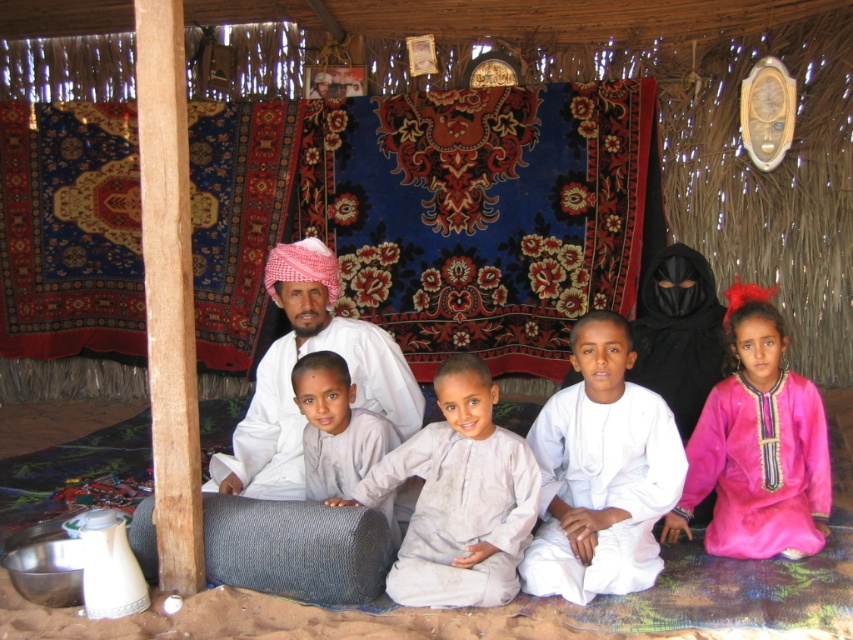
Question: Which object is closer to the camera taking this photo?

Choices:
 (A) white cotton clothing at center
 (B) light gray cotton shirt at center

Answer: (B)

Question: Considering the relative positions of white cotton shirt at center and black matte robe at right in the image provided, where is white cotton shirt at center located with respect to black matte robe at right?

Choices:
 (A) below
 (B) above

Answer: (A)

Question: Which point is farther to the camera?

Choices:
 (A) light gray cotton shirt at center
 (B) white cotton robe at center
 (C) white cotton clothing at center
 (D) black matte robe at right

Answer: (D)

Question: Does light gray cotton shirt at center have a lesser width compared to light beige fabric at center?

Choices:
 (A) yes
 (B) no

Answer: (B)

Question: Which of these objects is positioned farthest from the pink satin dress at center?

Choices:
 (A) white cotton clothing at center
 (B) black matte robe at right
 (C) light gray cotton shirt at center

Answer: (A)

Question: Does white cotton shirt at center appear on the right side of pink satin dress at center?

Choices:
 (A) yes
 (B) no

Answer: (B)